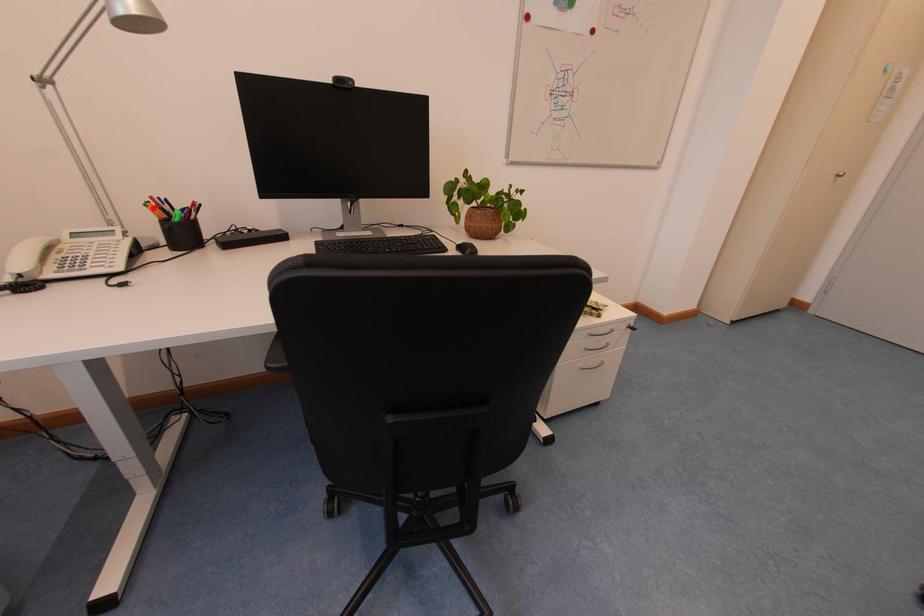
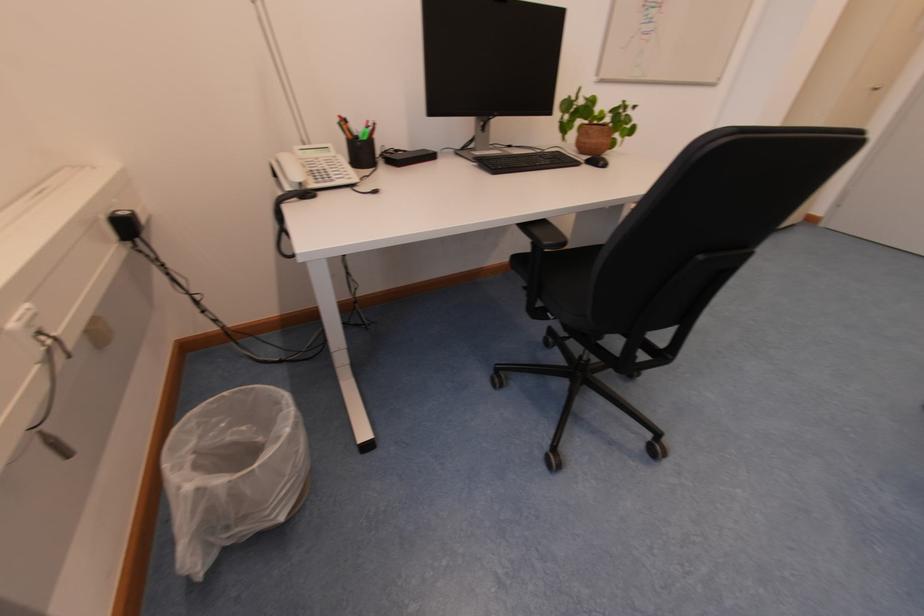
In the second image, find the point that corresponds to the highlighted location in the first image.

(347, 127)